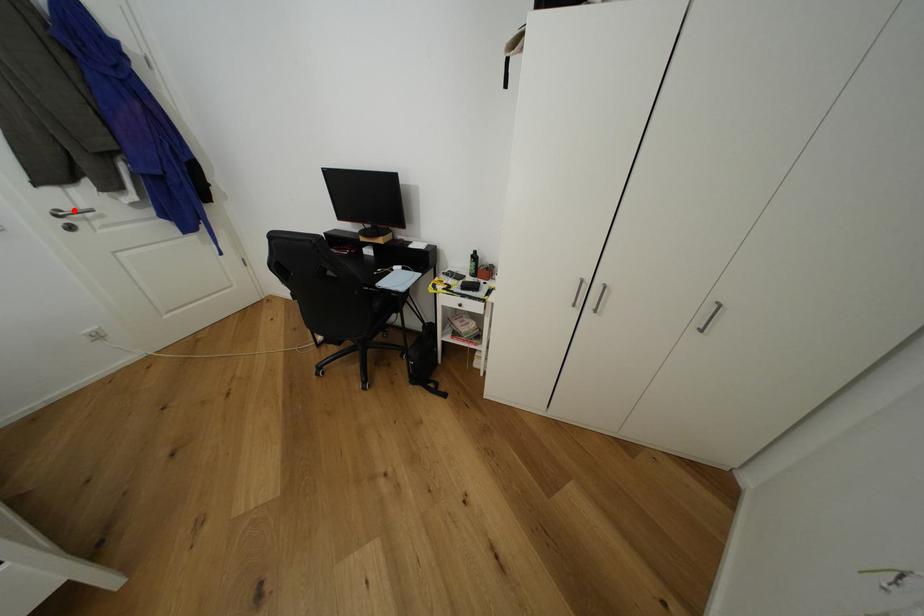
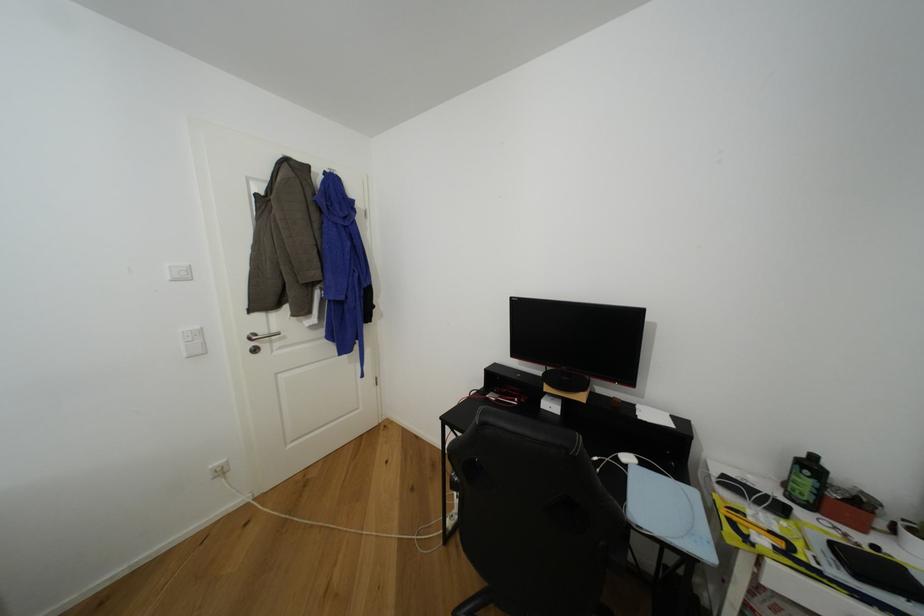
In the second image, find the point that corresponds to the highlighted location in the first image.

(268, 334)